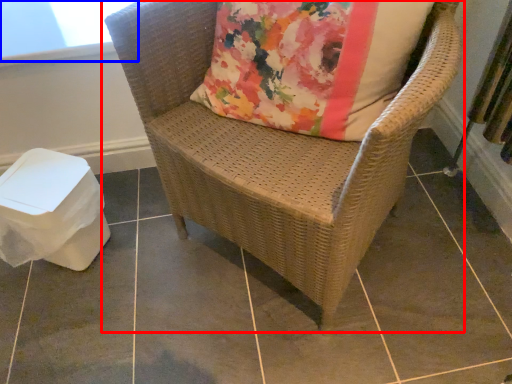
Question: Which point is further to the camera, chair (highlighted by a red box) or window screen (highlighted by a blue box)?

Choices:
 (A) chair
 (B) window screen

Answer: (B)